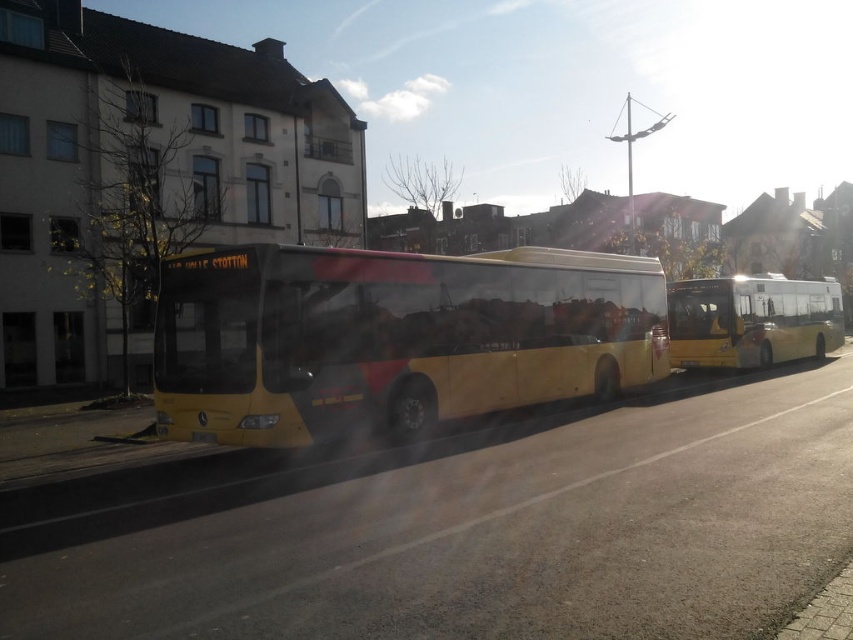
Which of these two, yellow matte bus at center or yellow metallic bus at right, stands taller?

yellow metallic bus at right is taller.

Who is shorter, yellow matte bus at center or yellow metallic bus at right?

yellow matte bus at center is shorter.

Between point (241, 314) and point (740, 292), which one is positioned in front?

Point (241, 314) is in front.

You are a GUI agent. You are given a task and a screenshot of the screen. Output one action in this format:
    pyautogui.click(x=<x>, y=<y>)
    Task: Click on the yellow matte bus at center
    The image size is (853, 640).
    Given the screenshot: What is the action you would take?
    pyautogui.click(x=392, y=337)